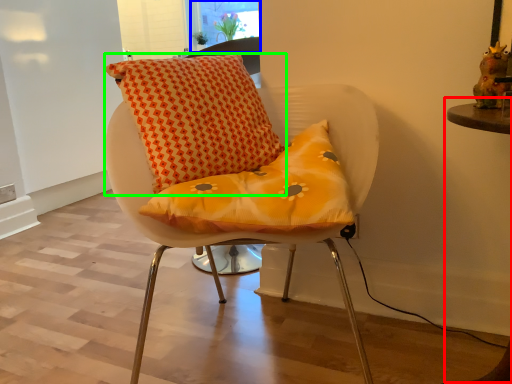
Question: Estimate the real-world distances between objects in this image. Which object is farther from table (highlighted by a red box), window screen (highlighted by a blue box) or pillow (highlighted by a green box)?

Choices:
 (A) window screen
 (B) pillow

Answer: (A)